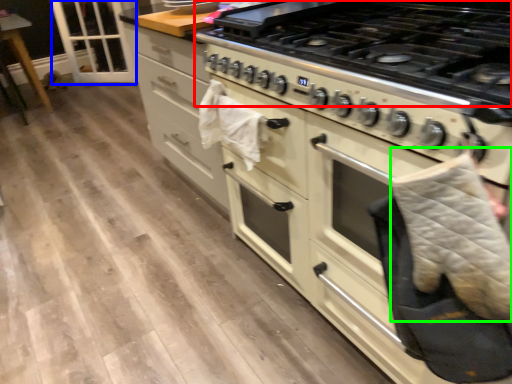
Question: Estimate the real-world distances between objects in this image. Which object is closer to gas stove (highlighted by a red box), glass door (highlighted by a blue box) or blanket (highlighted by a green box)?

Choices:
 (A) glass door
 (B) blanket

Answer: (B)